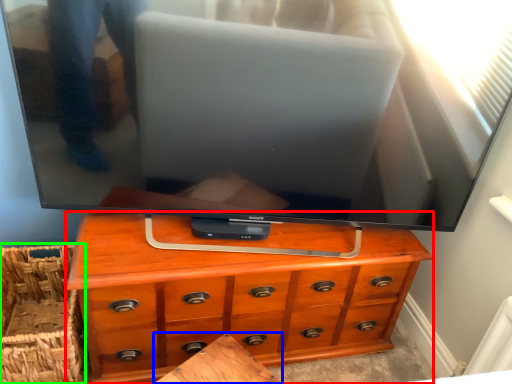
Question: Which object is the farthest from chest of drawers (highlighted by a red box)? Choose among these: table (highlighted by a blue box) or basket (highlighted by a green box).

Choices:
 (A) table
 (B) basket

Answer: (B)